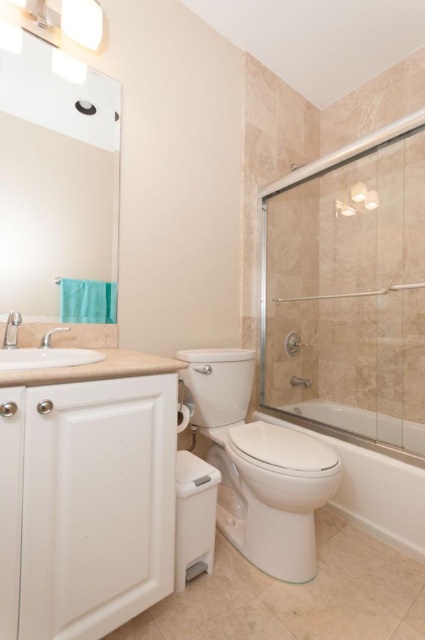
Is white glossy bathtub at lower right to the right of white porcelain sink at left from the viewer's perspective?

Yes, white glossy bathtub at lower right is to the right of white porcelain sink at left.

Is white glossy bathtub at lower right bigger than white porcelain sink at left?

Indeed, white glossy bathtub at lower right has a larger size compared to white porcelain sink at left.

Which is in front, point (277, 419) or point (56, 356)?

Point (56, 356) is more forward.

Find the location of a particular element. white glossy bathtub at lower right is located at coordinates (374, 492).

Consider the image. Which is more to the left, white glossy toilet at center or white glossy bathtub at lower right?

white glossy toilet at center is more to the left.

Does white glossy toilet at center have a greater height compared to white glossy bathtub at lower right?

Indeed, white glossy toilet at center has a greater height compared to white glossy bathtub at lower right.

Between point (263, 506) and point (354, 445), which one is positioned in front?

Point (263, 506) is more forward.

The image size is (425, 640). I want to click on white glossy toilet at center, so click(258, 467).

Between white glossy toilet at center and white porcelain sink at left, which one has more height?

white glossy toilet at center is taller.

Where is `white glossy toilet at center`? The height and width of the screenshot is (640, 425). white glossy toilet at center is located at coordinates (258, 467).

Between point (260, 513) and point (17, 316), which one is positioned in front?

Point (17, 316) is more forward.

Identify the location of white glossy toilet at center. (258, 467).